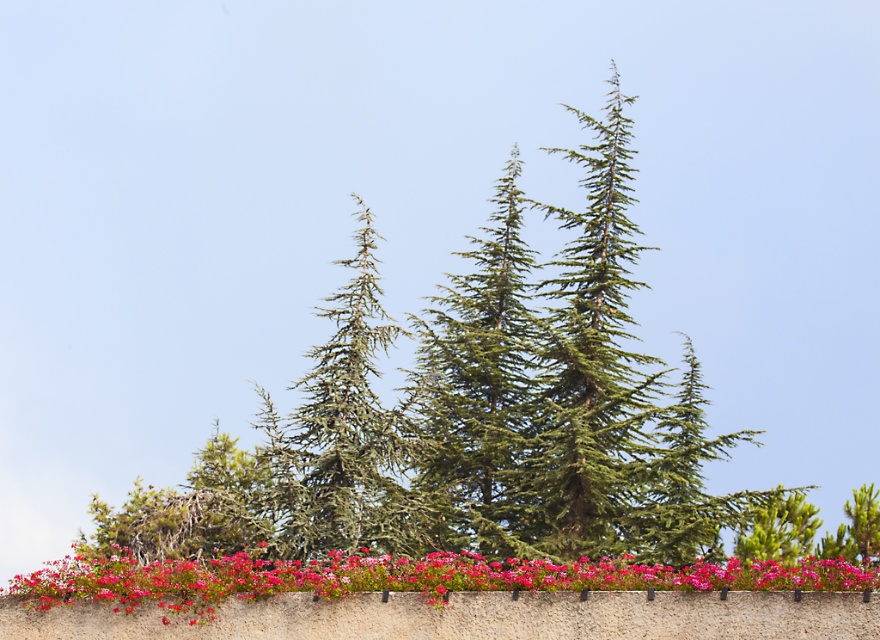
Does smooth pink petals at lower center have a lesser width compared to green needle-like at center?

In fact, smooth pink petals at lower center might be wider than green needle-like at center.

Is smooth pink petals at lower center shorter than green needle-like at center?

Yes, smooth pink petals at lower center is shorter than green needle-like at center.

Find the location of a particular element. The image size is (880, 640). smooth pink petals at lower center is located at coordinates (401, 579).